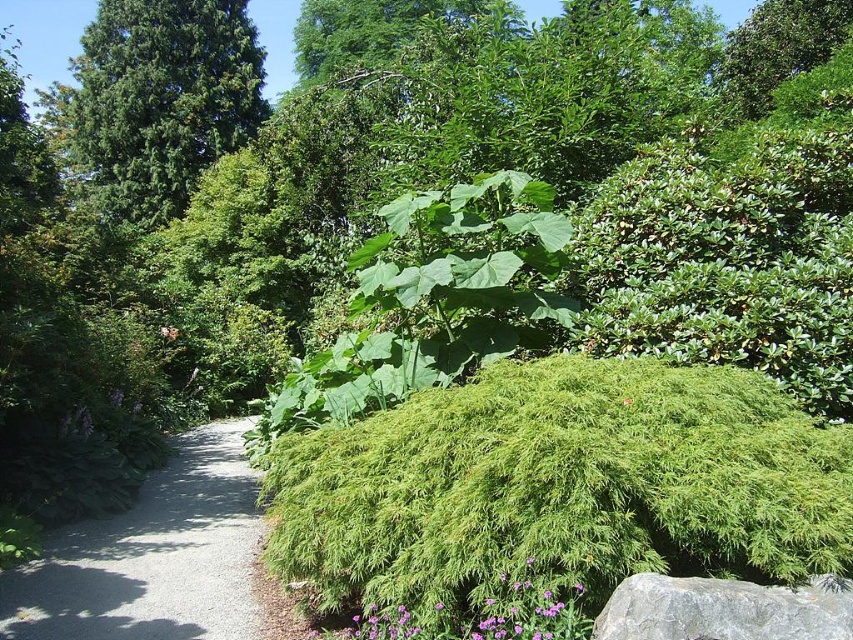
Based on the photo, can you confirm if green leafy bush at center is positioned below green needle-like at upper left?

Correct, green leafy bush at center is located below green needle-like at upper left.

Who is more distant from viewer, (498, 520) or (61, 108)?

Positioned behind is point (61, 108).

The height and width of the screenshot is (640, 853). I want to click on green leafy bush at center, so click(x=560, y=486).

Who is shorter, green leafy bush at center or gray gravel path at lower left?

gray gravel path at lower left

Does point (631, 570) come farther from viewer compared to point (47, 554)?

No, (631, 570) is closer to viewer.

Between point (338, 499) and point (230, 614), which one is positioned in front?

Point (338, 499) is more forward.

Find the location of `green leafy bush at center`. green leafy bush at center is located at coordinates (560, 486).

How distant is gray gravel path at lower left from gray rough rock at lower right?

gray gravel path at lower left and gray rough rock at lower right are 8.54 feet apart.

At what (x,y) coordinates should I click in order to perform the action: click on gray gravel path at lower left. Please return your answer as a coordinate pair (x, y). The height and width of the screenshot is (640, 853). Looking at the image, I should click on (152, 556).

This screenshot has height=640, width=853. What are the coordinates of `gray gravel path at lower left` in the screenshot? It's located at (152, 556).

What are the coordinates of `gray gravel path at lower left` in the screenshot? It's located at (152, 556).